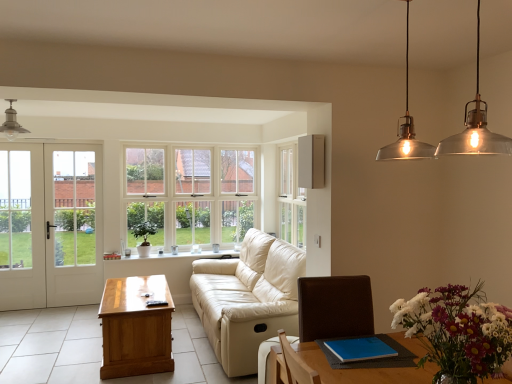
Question: Is multicolored floral bouquet at lower right completely or partially inside white glass window at center?

Choices:
 (A) no
 (B) yes

Answer: (A)

Question: Are white glass window at center and multicolored floral bouquet at lower right making contact?

Choices:
 (A) yes
 (B) no

Answer: (B)

Question: Is white glass window at center positioned before multicolored floral bouquet at lower right?

Choices:
 (A) no
 (B) yes

Answer: (A)

Question: Does white glass window at center have a lesser height compared to multicolored floral bouquet at lower right?

Choices:
 (A) yes
 (B) no

Answer: (B)

Question: Is the depth of white glass window at center greater than that of multicolored floral bouquet at lower right?

Choices:
 (A) no
 (B) yes

Answer: (B)

Question: From the image's perspective, is light beige leather armchair at lower center positioned above or below multicolored floral bouquet at lower right?

Choices:
 (A) below
 (B) above

Answer: (A)

Question: From a real-world perspective, is light beige leather armchair at lower center above or below multicolored floral bouquet at lower right?

Choices:
 (A) above
 (B) below

Answer: (B)

Question: Is point (274, 339) closer or farther from the camera than point (489, 370)?

Choices:
 (A) farther
 (B) closer

Answer: (A)

Question: Is light beige leather armchair at lower center wider or thinner than multicolored floral bouquet at lower right?

Choices:
 (A) thin
 (B) wide

Answer: (B)

Question: Considering the positions of white glass window at center and wooden coffee table at center in the image, is white glass window at center taller or shorter than wooden coffee table at center?

Choices:
 (A) tall
 (B) short

Answer: (A)

Question: From the image's perspective, is white glass window at center located above or below wooden coffee table at center?

Choices:
 (A) below
 (B) above

Answer: (B)

Question: Is white glass window at center wider or thinner than wooden coffee table at center?

Choices:
 (A) thin
 (B) wide

Answer: (A)

Question: Visually, is white glass window at center positioned to the left or to the right of wooden coffee table at center?

Choices:
 (A) right
 (B) left

Answer: (A)

Question: In terms of width, does multicolored floral bouquet at lower right look wider or thinner when compared to light brown wooden table at left?

Choices:
 (A) wide
 (B) thin

Answer: (B)

Question: Is multicolored floral bouquet at lower right bigger or smaller than light brown wooden table at left?

Choices:
 (A) big
 (B) small

Answer: (B)